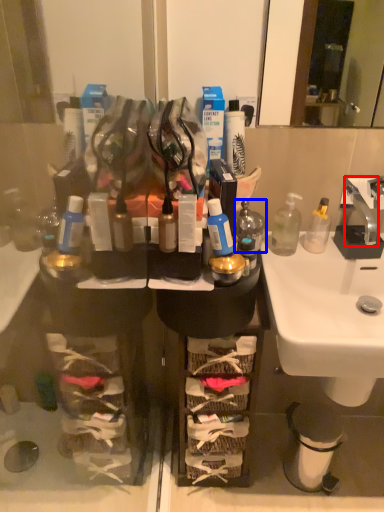
Question: Among these objects, which one is farthest to the camera, faucet (highlighted by a red box) or bottle (highlighted by a blue box)?

Choices:
 (A) faucet
 (B) bottle

Answer: (A)